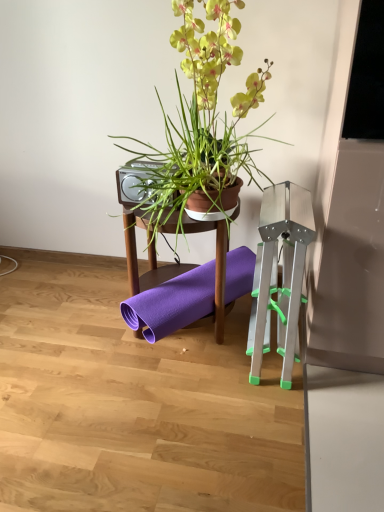
Describe the element at coordinates (138, 182) in the screenshot. Image resolution: width=384 pixels, height=512 pixels. I see `silver metallic speaker at upper center` at that location.

Describe the element at coordinates (203, 121) in the screenshot. Image resolution: width=384 pixels, height=512 pixels. I see `green matte plant pot at upper center` at that location.

Image resolution: width=384 pixels, height=512 pixels. I want to click on silver metallic speaker at upper center, so click(138, 182).

Could silver metallic speaker at upper center be considered to be inside green matte plant pot at upper center?

Yes, silver metallic speaker at upper center is surrounded by green matte plant pot at upper center.

Between green matte plant pot at upper center and silver metallic speaker at upper center, which one has smaller size?

Smaller between the two is silver metallic speaker at upper center.

Is green matte plant pot at upper center further to the viewer compared to silver metallic speaker at upper center?

No, it is in front of silver metallic speaker at upper center.

Could you tell me if green matte plant pot at upper center is facing silver metallic speaker at upper center?

No, green matte plant pot at upper center is not turned towards silver metallic speaker at upper center.

Are purple rubber yoga mat at center and silver metallic speaker at upper center making contact?

No, purple rubber yoga mat at center is not in contact with silver metallic speaker at upper center.

Based on the photo, can you confirm if purple rubber yoga mat at center is shorter than silver metallic speaker at upper center?

In fact, purple rubber yoga mat at center may be taller than silver metallic speaker at upper center.

Consider the image. Is purple rubber yoga mat at center not inside silver metallic speaker at upper center?

Yes, purple rubber yoga mat at center is located beyond the bounds of silver metallic speaker at upper center.

Is metallic silver easel at right facing away from silver metallic speaker at upper center?

No, metallic silver easel at right's orientation is not away from silver metallic speaker at upper center.

Is metallic silver easel at right not near silver metallic speaker at upper center?

metallic silver easel at right is near silver metallic speaker at upper center, not far away.

How distant is silver metallic speaker at upper center from purple rubber yoga mat at center?

The distance of silver metallic speaker at upper center from purple rubber yoga mat at center is 9.14 inches.

Who is smaller, silver metallic speaker at upper center or purple rubber yoga mat at center?

silver metallic speaker at upper center.

From a real-world perspective, is silver metallic speaker at upper center physically above purple rubber yoga mat at center?

Yes, from a real-world perspective, silver metallic speaker at upper center is above purple rubber yoga mat at center.

Is silver metallic speaker at upper center looking in the opposite direction of metallic silver easel at right?

That's not correct — silver metallic speaker at upper center is not looking away from metallic silver easel at right.

Identify the location of easel directly beneath the silver metallic speaker at upper center (from a real-world perspective). This screenshot has width=384, height=512. (282, 275).

From the picture: From a real-world perspective, is silver metallic speaker at upper center physically below metallic silver easel at right?

Incorrect, from a real-world perspective, silver metallic speaker at upper center is higher than metallic silver easel at right.

From the image's perspective, between silver metallic speaker at upper center and metallic silver easel at right, who is located below?

metallic silver easel at right, from the image's perspective.

From the image's perspective, is purple rubber yoga mat at center above green matte plant pot at upper center?

Incorrect, from the image's perspective, purple rubber yoga mat at center is lower than green matte plant pot at upper center.

Is purple rubber yoga mat at center facing towards green matte plant pot at upper center?

No.

Consider the image. From their relative heights in the image, would you say purple rubber yoga mat at center is taller or shorter than green matte plant pot at upper center?

Clearly, purple rubber yoga mat at center is shorter compared to green matte plant pot at upper center.

Looking at this image, would you consider silver metallic speaker at upper center to be distant from green matte plant pot at upper center?

silver metallic speaker at upper center is near green matte plant pot at upper center, not far away.

Is point (153, 170) closer to camera compared to point (194, 40)?

No, it is behind (194, 40).

Between silver metallic speaker at upper center and green matte plant pot at upper center, which one appears on the right side from the viewer's perspective?

green matte plant pot at upper center.

Which of these two, silver metallic speaker at upper center or green matte plant pot at upper center, is thinner?

With smaller width is silver metallic speaker at upper center.

Locate an element on the screen. houseplant located in front of the silver metallic speaker at upper center is located at coordinates (203, 121).

I want to click on furniture that is below the silver metallic speaker at upper center (from the image's perspective), so (x=148, y=257).

Which object lies nearer to the anchor point metallic silver easel at right, silver metallic speaker at upper center or purple rubber yoga mat at center?

purple rubber yoga mat at center is closer to metallic silver easel at right.

When comparing their distances from green matte plant pot at upper center, does metallic silver easel at right or purple rubber yoga mat at center seem further?

Based on the image, metallic silver easel at right appears to be further to green matte plant pot at upper center.

Considering their positions, is metallic silver easel at right positioned closer to silver metallic speaker at upper center than green matte plant pot at upper center?

green matte plant pot at upper center is closer to silver metallic speaker at upper center.

Considering their positions, is green matte plant pot at upper center positioned closer to silver metallic speaker at upper center than metallic silver easel at right?

green matte plant pot at upper center lies closer to silver metallic speaker at upper center than the other object.

Estimate the real-world distances between objects in this image. Which object is closer to green matte plant pot at upper center, purple rubber yoga mat at center or metallic silver easel at right?

purple rubber yoga mat at center is positioned closer to the anchor green matte plant pot at upper center.

Estimate the real-world distances between objects in this image. Which object is further from purple rubber yoga mat at center, green matte plant pot at upper center or metallic silver easel at right?

Based on the image, metallic silver easel at right appears to be further to purple rubber yoga mat at center.

Which object lies nearer to the anchor point green matte plant pot at upper center, silver metallic speaker at upper center or metallic silver easel at right?

silver metallic speaker at upper center lies closer to green matte plant pot at upper center than the other object.

Based on their spatial positions, is purple rubber yoga mat at center or silver metallic speaker at upper center closer to metallic silver easel at right?

purple rubber yoga mat at center.

You are a GUI agent. You are given a task and a screenshot of the screen. Output one action in this format:
    pyautogui.click(x=<x>, y=<y>)
    Task: Click on the furniture between silver metallic speaker at upper center and metallic silver easel at right from left to right
    This screenshot has height=512, width=384.
    Given the screenshot: What is the action you would take?
    pyautogui.click(x=148, y=257)

You are a GUI agent. You are given a task and a screenshot of the screen. Output one action in this format:
    pyautogui.click(x=<x>, y=<y>)
    Task: Click on the easel between green matte plant pot at upper center and purple rubber yoga mat at center from front to back
    The height and width of the screenshot is (512, 384).
    Given the screenshot: What is the action you would take?
    pyautogui.click(x=282, y=275)

Where is `houseplant between silver metallic speaker at upper center and metallic silver easel at right from left to right`? This screenshot has width=384, height=512. houseplant between silver metallic speaker at upper center and metallic silver easel at right from left to right is located at coordinates (203, 121).

At what (x,y) coordinates should I click in order to perform the action: click on furniture located between green matte plant pot at upper center and silver metallic speaker at upper center in the depth direction. Please return your answer as a coordinate pair (x, y). This screenshot has width=384, height=512. Looking at the image, I should click on (148, 257).